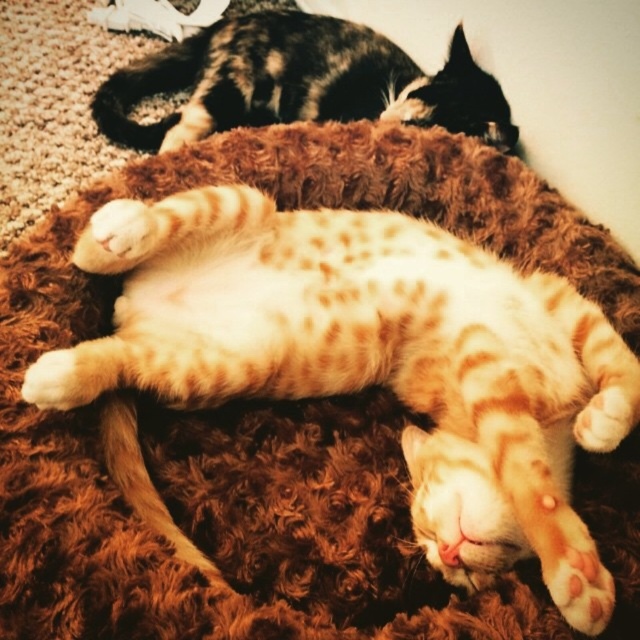
Can you confirm if orange spotted fur cat at center is positioned above tabby fur cat at upper center?

Incorrect, orange spotted fur cat at center is not positioned above tabby fur cat at upper center.

How far apart are orange spotted fur cat at center and tabby fur cat at upper center?

29.10 inches

The width and height of the screenshot is (640, 640). What do you see at coordinates (372, 360) in the screenshot?
I see `orange spotted fur cat at center` at bounding box center [372, 360].

The width and height of the screenshot is (640, 640). What are the coordinates of `orange spotted fur cat at center` in the screenshot? It's located at (372, 360).